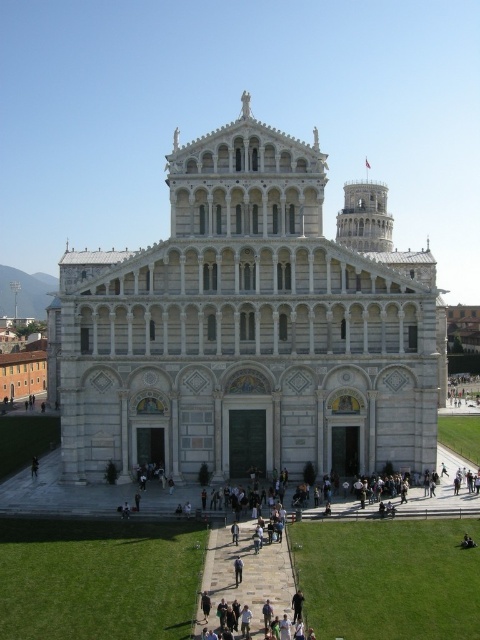
Question: Can you confirm if white stone cathedral at center is bigger than dark blue jeans at lower left?

Choices:
 (A) yes
 (B) no

Answer: (A)

Question: Does white stone cathedral at center come in front of dark blue jeans at lower left?

Choices:
 (A) yes
 (B) no

Answer: (A)

Question: Is white stone cathedral at center further to camera compared to dark blue jeans at lower left?

Choices:
 (A) no
 (B) yes

Answer: (A)